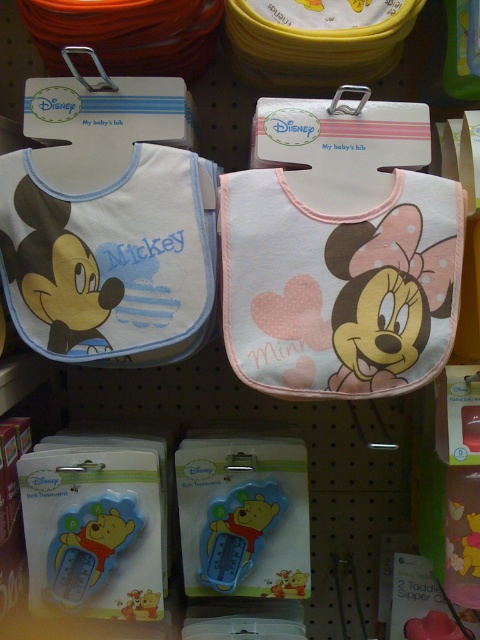
Is matte white bib at center closer to camera compared to blue rubber thermometer at center?

Yes, it is in front of blue rubber thermometer at center.

Identify the location of matte white bib at center. The width and height of the screenshot is (480, 640). (111, 260).

Is matte white bib at center to the right of blue rubber thermometer at lower left from the viewer's perspective?

Correct, you'll find matte white bib at center to the right of blue rubber thermometer at lower left.

Between matte white bib at center and blue rubber thermometer at lower left, which one has less height?

Standing shorter between the two is blue rubber thermometer at lower left.

Image resolution: width=480 pixels, height=640 pixels. Describe the element at coordinates (111, 260) in the screenshot. I see `matte white bib at center` at that location.

Where is `matte white bib at center`? matte white bib at center is located at coordinates (111, 260).

Can you confirm if pastel pink fabric minnie mouse bib at center is thinner than matte white bib at center?

Incorrect, pastel pink fabric minnie mouse bib at center's width is not less than matte white bib at center's.

Between point (219, 184) and point (200, 161), which one is positioned behind?

Point (200, 161)

Where is `pastel pink fabric minnie mouse bib at center`? pastel pink fabric minnie mouse bib at center is located at coordinates (339, 288).